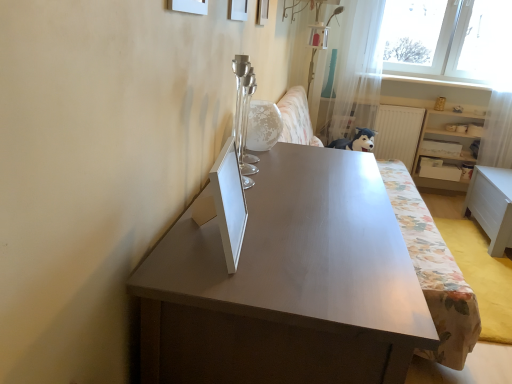
Question: Is floral fabric couch at center bigger or smaller than white glossy table at lower right, which is the first table from right to left?

Choices:
 (A) small
 (B) big

Answer: (B)

Question: In the image, is floral fabric couch at center on the left side or the right side of white glossy table at lower right, placed as the second table when sorted from front to back?

Choices:
 (A) left
 (B) right

Answer: (A)

Question: Estimate the real-world distances between objects in this image. Which object is closer to the white matte picture frame at upper center, which appears as the 1th picture frame when viewed from the front?

Choices:
 (A) white glossy globe at center
 (B) white glossy table at lower right, positioned as the 1th table in back-to-front order
 (C) floral fabric couch at center
 (D) white wooden shelf at right
 (E) translucent fabric curtain at upper right

Answer: (A)

Question: Which object is the farthest from the white matte drawer at right?

Choices:
 (A) white matte picture frame at upper center, which is the 3th picture frame from right to left
 (B) white matte picture frame at upper center, the 3th picture frame when ordered from left to right
 (C) white glossy globe at center
 (D) floral fabric couch at center
 (E) white matte picture frame at upper center, the second picture frame positioned from the right

Answer: (A)